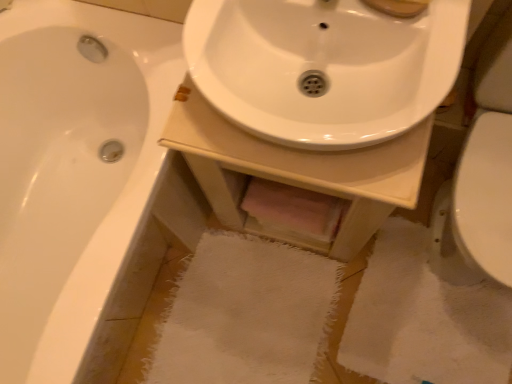
Where is `white glossy sink at center`? white glossy sink at center is located at coordinates (323, 67).

Is white glossy sink at center oriented towards white glossy sink at center?

No.

Considering the sizes of objects white glossy sink at center and white glossy sink at center in the image provided, who is bigger, white glossy sink at center or white glossy sink at center?

With larger size is white glossy sink at center.

Is white glossy sink at center spatially inside white glossy sink at center, or outside of it?

white glossy sink at center is spatially situated outside white glossy sink at center.

Which is behind, point (176, 105) or point (237, 35)?

Point (237, 35)

Considering the relative sizes of white glossy bathtub at left and white glossy sink at center in the image provided, is white glossy bathtub at left smaller than white glossy sink at center?

Incorrect, white glossy bathtub at left is not smaller in size than white glossy sink at center.

Is white glossy bathtub at left looking in the opposite direction of white glossy sink at center?

No, white glossy bathtub at left is not facing the opposite direction of white glossy sink at center.

Is white glossy bathtub at left directly adjacent to white glossy sink at center?

white glossy bathtub at left and white glossy sink at center are clearly separated.

Is white glossy bathtub at left spatially inside white glossy sink at center, or outside of it?

white glossy bathtub at left exists outside the volume of white glossy sink at center.

Is point (254, 93) closer or farther from the camera than point (332, 218)?

Point (254, 93) appears to be closer to the viewer than point (332, 218).

Is white glossy sink at center placed right next to white glossy sink at center?

No, white glossy sink at center is not beside white glossy sink at center.

From the picture: Can you confirm if white glossy sink at center is thinner than white glossy sink at center?

Correct, the width of white glossy sink at center is less than that of white glossy sink at center.

Between white glossy sink at center and white glossy sink at center, which one has more height?

Standing taller between the two is white glossy sink at center.

From the picture: Which is more to the left, white glossy bathtub at left or white glossy sink at center?

white glossy bathtub at left is more to the left.

Does point (106, 179) come behind point (191, 36)?

Yes.

Is white glossy bathtub at left outside of white glossy sink at center?

Absolutely, white glossy bathtub at left is external to white glossy sink at center.

Find the location of a particular element. The height and width of the screenshot is (384, 512). bathtub located behind the white glossy sink at center is located at coordinates (72, 171).

Considering the relative sizes of white glossy sink at center and white glossy bathtub at left in the image provided, is white glossy sink at center thinner than white glossy bathtub at left?

Yes.

Considering the positions of point (404, 189) and point (27, 245), is point (404, 189) closer or farther from the camera than point (27, 245)?

Point (404, 189).

From a real-world perspective, is white glossy sink at center located higher than white glossy bathtub at left?

Correct, in the physical world, white glossy sink at center is higher than white glossy bathtub at left.

Considering the sizes of white glossy sink at center and white glossy bathtub at left in the image, is white glossy sink at center bigger or smaller than white glossy bathtub at left?

In the image, white glossy sink at center appears to be smaller than white glossy bathtub at left.

How different are the orientations of white glossy sink at center and white glossy bathtub at left in degrees?

The facing directions of white glossy sink at center and white glossy bathtub at left are 89.6 degrees apart.

From a real-world perspective, does white glossy sink at center stand above white glossy bathtub at left?

Yes.

Considering the positions of objects white glossy sink at center and white glossy bathtub at left in the image provided, who is behind, white glossy sink at center or white glossy bathtub at left?

white glossy bathtub at left is further away from the camera.

Which of these two, white glossy sink at center or white glossy bathtub at left, stands taller?

white glossy bathtub at left is taller.

You are a GUI agent. You are given a task and a screenshot of the screen. Output one action in this format:
    pyautogui.click(x=<x>, y=<y>)
    Task: Click on the sink that is above the white glossy sink at center (from a real-world perspective)
    
    Given the screenshot: What is the action you would take?
    pyautogui.click(x=323, y=67)

This screenshot has height=384, width=512. In the image, there is a white glossy bathtub at left. In order to click on counter top above it (from the image's perspective) in this screenshot , I will do `click(296, 179)`.

Considering their positions, is white glossy sink at center positioned closer to white glossy bathtub at left than white glossy sink at center?

The object closer to white glossy bathtub at left is white glossy sink at center.

From the image, which object appears to be nearer to white glossy sink at center, white glossy sink at center or white glossy bathtub at left?

Among the two, white glossy sink at center is located nearer to white glossy sink at center.

Which object lies nearer to the anchor point white glossy sink at center, white glossy sink at center or white glossy bathtub at left?

white glossy sink at center is closer to white glossy sink at center.

When comparing their distances from white glossy sink at center, does white glossy bathtub at left or white glossy sink at center seem closer?

The object closer to white glossy sink at center is white glossy sink at center.

Estimate the real-world distances between objects in this image. Which object is further from white glossy sink at center, white glossy bathtub at left or white glossy sink at center?

white glossy bathtub at left is further to white glossy sink at center.

Estimate the real-world distances between objects in this image. Which object is further from white glossy bathtub at left, white glossy sink at center or white glossy sink at center?

Based on the image, white glossy sink at center appears to be further to white glossy bathtub at left.

The image size is (512, 384). Find the location of `sink between white glossy bathtub at left and white glossy sink at center in the horizontal direction`. sink between white glossy bathtub at left and white glossy sink at center in the horizontal direction is located at coordinates (323, 67).